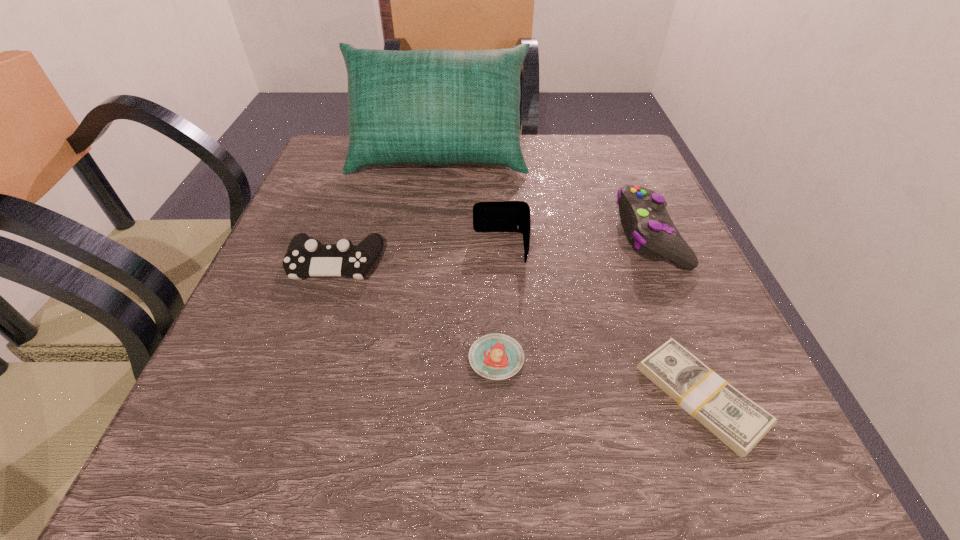
In order to click on vacant region at the near right corner of the desktop in this screenshot , I will do `click(710, 442)`.

You are a GUI agent. You are given a task and a screenshot of the screen. Output one action in this format:
    pyautogui.click(x=<x>, y=<y>)
    Task: Click on the vacant space that is in between the tallest object and the shortest object
    The width and height of the screenshot is (960, 540).
    Given the screenshot: What is the action you would take?
    pyautogui.click(x=569, y=276)

Where is `free point between the taller control and the farthest object`? This screenshot has width=960, height=540. free point between the taller control and the farthest object is located at coordinates (544, 196).

Where is `vacant area between the pastry and the shortest object`? vacant area between the pastry and the shortest object is located at coordinates (598, 377).

The image size is (960, 540). In order to click on vacant region between the third shortest object and the taller control in this screenshot , I will do `click(492, 249)`.

Where is `free spot between the fourth tallest object and the cushion`? The width and height of the screenshot is (960, 540). free spot between the fourth tallest object and the cushion is located at coordinates (387, 210).

Find the location of `vacant space that is in between the fifth tallest object and the right control`. vacant space that is in between the fifth tallest object and the right control is located at coordinates (573, 297).

You are a GUI agent. You are given a task and a screenshot of the screen. Output one action in this format:
    pyautogui.click(x=<x>, y=<y>)
    Task: Click on the vacant region between the shortest object and the wallet
    Image resolution: width=960 pixels, height=540 pixels.
    Given the screenshot: What is the action you would take?
    pyautogui.click(x=601, y=322)

Locate an element on the screen. This screenshot has height=540, width=960. free space between the fifth tallest object and the tallest object is located at coordinates (468, 258).

I want to click on unoccupied area between the farthest object and the left control, so click(x=387, y=210).